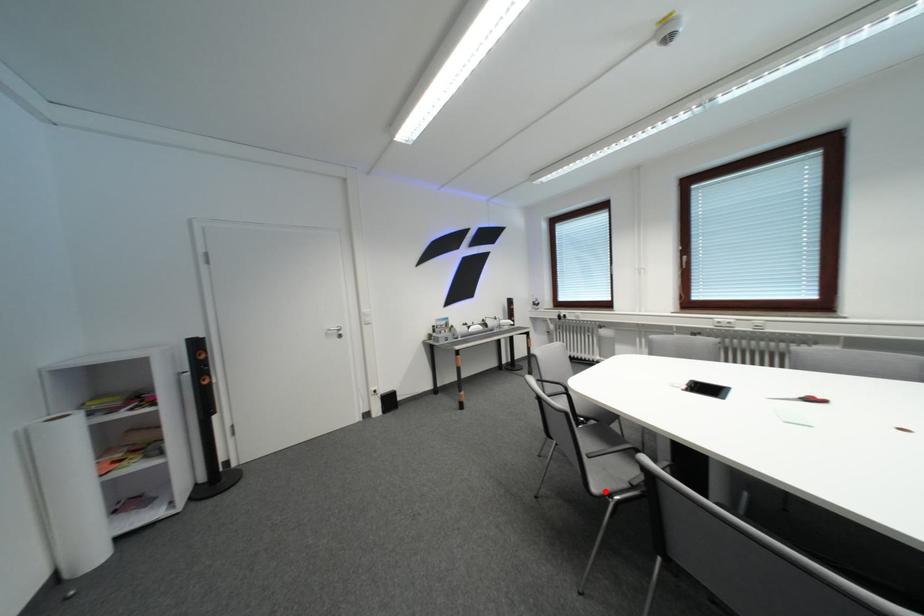
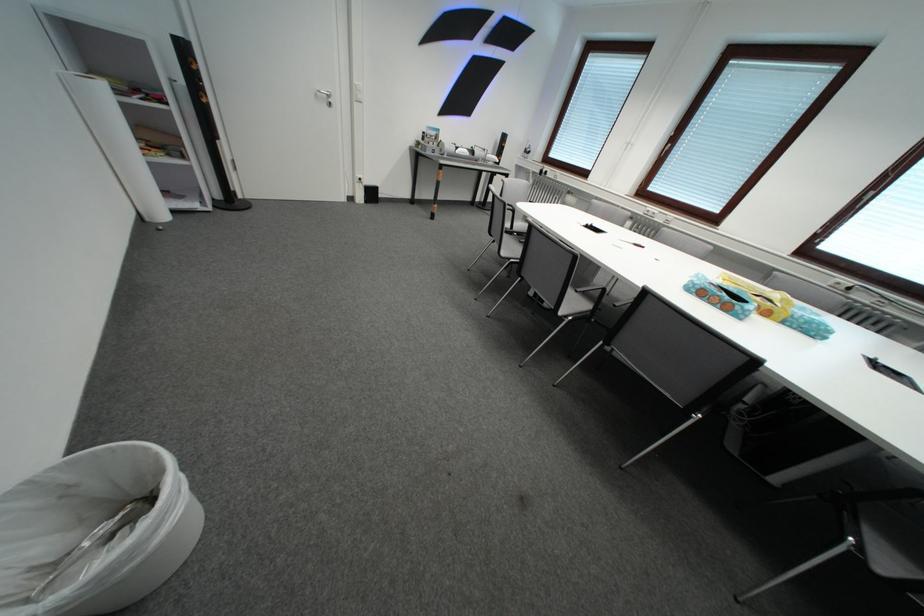
Question: A red point is marked in image1. In image2, is the corresponding 3D point closer to the camera or farther? Reply with the corresponding letter.

Choices:
 (A) The corresponding 3D point is closer.
 (B) The corresponding 3D point is farther.

Answer: (A)